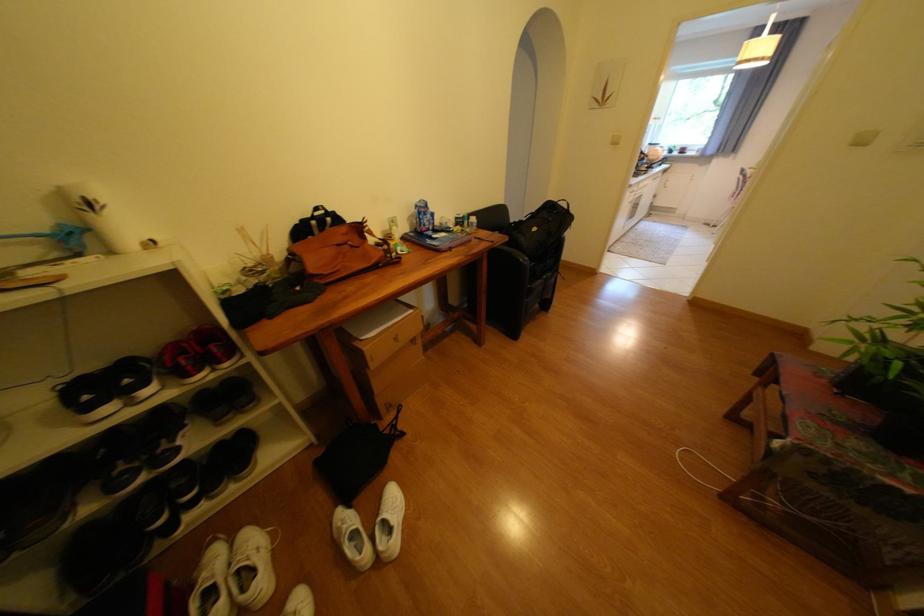
This screenshot has height=616, width=924. What do you see at coordinates (396, 339) in the screenshot?
I see `a cardboard drawer handle` at bounding box center [396, 339].